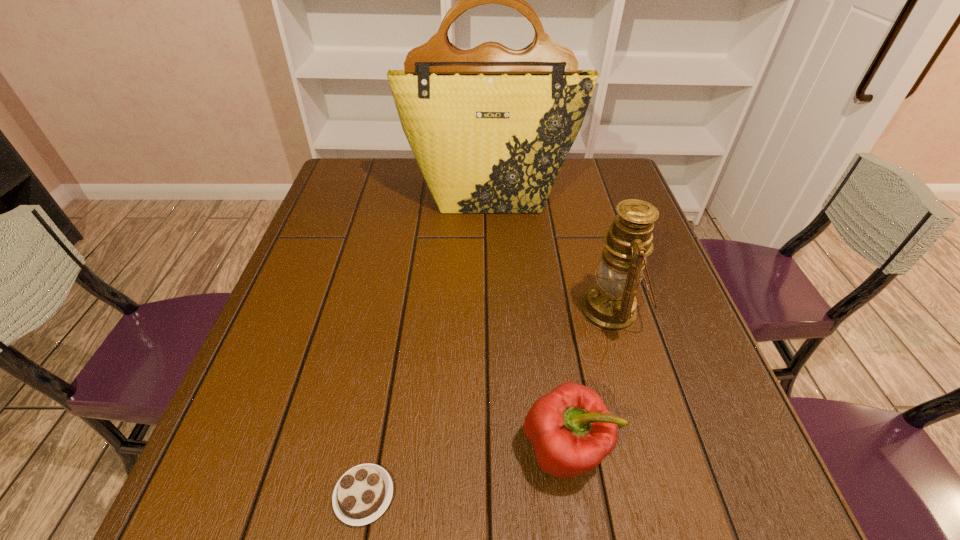
The height and width of the screenshot is (540, 960). Find the location of `object located at the far edge`. object located at the far edge is located at coordinates (490, 127).

Where is `bell pepper that is at the near edge`? This screenshot has height=540, width=960. bell pepper that is at the near edge is located at coordinates (572, 431).

Where is `chocolate cake that is at the near edge`? This screenshot has height=540, width=960. chocolate cake that is at the near edge is located at coordinates (363, 493).

In order to click on object at the right edge in this screenshot , I will do `click(610, 305)`.

The image size is (960, 540). What are the coordinates of `vacant area at the far edge of the desktop` in the screenshot? It's located at (x=392, y=172).

In the image, there is a desktop. Where is `free space at the near edge`? free space at the near edge is located at coordinates (655, 488).

Where is `vacant area at the left edge`? This screenshot has height=540, width=960. vacant area at the left edge is located at coordinates (348, 306).

Image resolution: width=960 pixels, height=540 pixels. I want to click on blank area at the right edge, so click(x=660, y=365).

You are a GUI agent. You are given a task and a screenshot of the screen. Output one action in this format:
    pyautogui.click(x=<x>, y=<y>)
    Task: Click on the vacant point at the near left corner
    Image resolution: width=960 pixels, height=540 pixels.
    Given the screenshot: What is the action you would take?
    pyautogui.click(x=282, y=521)

Find the location of a particular element. Image resolution: width=960 pixels, height=540 pixels. vacant space at the far right corner is located at coordinates (627, 198).